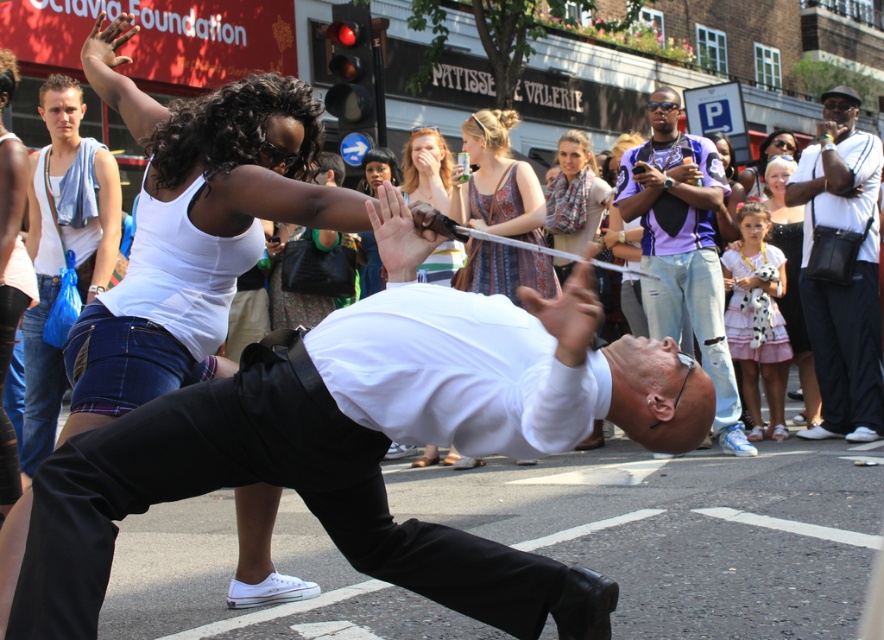
Does white matte tank top at upper left have a greater width compared to pink satin dress at center?

Yes.

This screenshot has width=884, height=640. What do you see at coordinates (226, 147) in the screenshot?
I see `white matte tank top at upper left` at bounding box center [226, 147].

The image size is (884, 640). I want to click on white matte tank top at upper left, so click(x=226, y=147).

Can you confirm if patterned scarf at upper center is taller than matte white blouse at upper center?

Correct, patterned scarf at upper center is much taller as matte white blouse at upper center.

Locate an element on the screen. This screenshot has height=640, width=884. patterned scarf at upper center is located at coordinates (574, 195).

Can you confirm if white cotton shirt at upper right is thinner than white cotton tank top at upper left?

Incorrect, white cotton shirt at upper right's width is not less than white cotton tank top at upper left's.

Who is higher up, white cotton shirt at upper right or white cotton tank top at upper left?

white cotton shirt at upper right

Locate an element on the screen. The image size is (884, 640). white cotton shirt at upper right is located at coordinates (850, 273).

Identify the location of white cotton shirt at upper right. This screenshot has height=640, width=884. (850, 273).